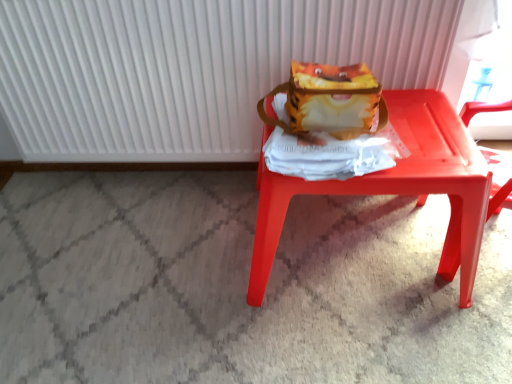
Question: From the image's perspective, does matte plastic stool at center appear lower than matte yellow fabric shoulder bag at center?

Choices:
 (A) yes
 (B) no

Answer: (A)

Question: Can you confirm if matte plastic stool at center is taller than matte yellow fabric shoulder bag at center?

Choices:
 (A) no
 (B) yes

Answer: (B)

Question: Is matte plastic stool at center thinner than matte yellow fabric shoulder bag at center?

Choices:
 (A) yes
 (B) no

Answer: (B)

Question: Can we say matte plastic stool at center lies outside matte yellow fabric shoulder bag at center?

Choices:
 (A) yes
 (B) no

Answer: (A)

Question: Considering the relative positions of matte plastic stool at center and matte yellow fabric shoulder bag at center in the image provided, is matte plastic stool at center to the right of matte yellow fabric shoulder bag at center from the viewer's perspective?

Choices:
 (A) yes
 (B) no

Answer: (A)

Question: From the image's perspective, is matte plastic stool at center over matte yellow fabric shoulder bag at center?

Choices:
 (A) yes
 (B) no

Answer: (B)

Question: Would you say matte yellow fabric shoulder bag at center is a long distance from white ribbed radiator at upper center?

Choices:
 (A) no
 (B) yes

Answer: (A)

Question: Considering the relative sizes of matte yellow fabric shoulder bag at center and white ribbed radiator at upper center in the image provided, is matte yellow fabric shoulder bag at center shorter than white ribbed radiator at upper center?

Choices:
 (A) yes
 (B) no

Answer: (A)

Question: From a real-world perspective, is matte yellow fabric shoulder bag at center located higher than white ribbed radiator at upper center?

Choices:
 (A) no
 (B) yes

Answer: (B)

Question: Is matte yellow fabric shoulder bag at center closer to the viewer compared to white ribbed radiator at upper center?

Choices:
 (A) yes
 (B) no

Answer: (A)

Question: Is matte yellow fabric shoulder bag at center bigger than white ribbed radiator at upper center?

Choices:
 (A) yes
 (B) no

Answer: (B)

Question: Considering the relative sizes of matte yellow fabric shoulder bag at center and white ribbed radiator at upper center in the image provided, is matte yellow fabric shoulder bag at center wider than white ribbed radiator at upper center?

Choices:
 (A) yes
 (B) no

Answer: (A)

Question: Could you tell me if white ribbed radiator at upper center is facing matte plastic stool at center?

Choices:
 (A) yes
 (B) no

Answer: (A)